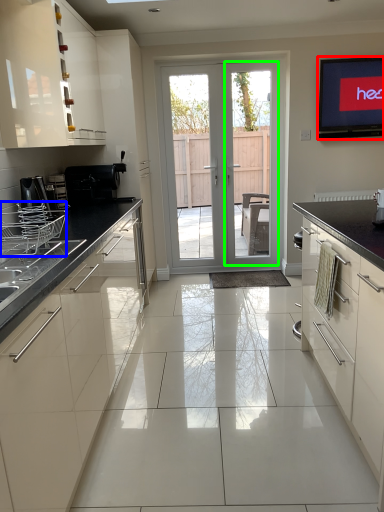
Question: Which object is positioned farthest from electronic (highlighted by a red box)? Select from appliance (highlighted by a blue box) and screen door (highlighted by a green box).

Choices:
 (A) appliance
 (B) screen door

Answer: (A)